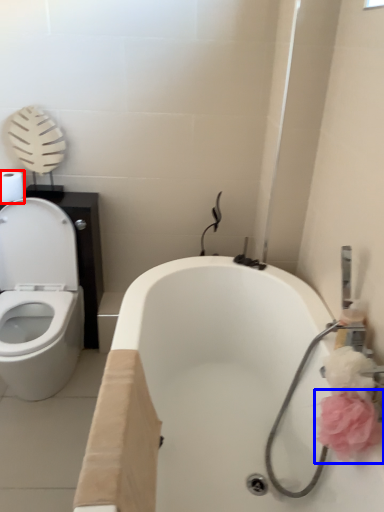
Question: Among these objects, which one is farthest to the camera, toilet paper (highlighted by a red box) or flower (highlighted by a blue box)?

Choices:
 (A) toilet paper
 (B) flower

Answer: (A)